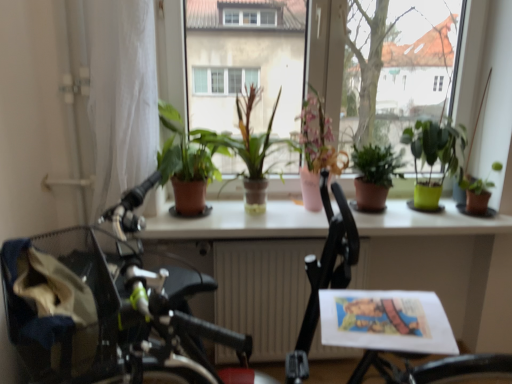
Question: Are green matte plant at center, the fourth houseplant viewed from the left, and green matte plant at center, placed as the 1th houseplant when sorted from left to right, far apart?

Choices:
 (A) no
 (B) yes

Answer: (A)

Question: Is green matte plant at center, placed as the 1th houseplant when sorted from left to right, located within green matte plant at center, the fourth houseplant viewed from the left?

Choices:
 (A) yes
 (B) no

Answer: (B)

Question: Does green matte plant at center, the fourth houseplant viewed from the left, have a larger size compared to green matte plant at center, the sixth houseplant positioned from the right?

Choices:
 (A) yes
 (B) no

Answer: (B)

Question: Considering the relative sizes of green matte plant at center, marked as the 3th houseplant in a right-to-left arrangement, and green matte plant at center, placed as the 1th houseplant when sorted from left to right, in the image provided, is green matte plant at center, marked as the 3th houseplant in a right-to-left arrangement, thinner than green matte plant at center, placed as the 1th houseplant when sorted from left to right,?

Choices:
 (A) yes
 (B) no

Answer: (A)

Question: Is green matte plant at center, the fourth houseplant viewed from the left, behind green matte plant at center, placed as the 1th houseplant when sorted from left to right?

Choices:
 (A) no
 (B) yes

Answer: (B)

Question: Can you confirm if green matte plant at center, the fourth houseplant viewed from the left, is shorter than green matte plant at center, placed as the 1th houseplant when sorted from left to right?

Choices:
 (A) no
 (B) yes

Answer: (B)

Question: Considering the relative sizes of pink ceramic vase at center, which is counted as the 4th houseplant, starting from the right, and green matte plant at center, the fourth houseplant viewed from the left, in the image provided, is pink ceramic vase at center, which is counted as the 4th houseplant, starting from the right, taller than green matte plant at center, the fourth houseplant viewed from the left,?

Choices:
 (A) yes
 (B) no

Answer: (A)

Question: Is green matte plant at center, the fourth houseplant viewed from the left, inside pink ceramic vase at center, which is counted as the 4th houseplant, starting from the right?

Choices:
 (A) yes
 (B) no

Answer: (B)

Question: Does pink ceramic vase at center, which is counted as the third houseplant, starting from the left, have a lesser height compared to green matte plant at center, marked as the 3th houseplant in a right-to-left arrangement?

Choices:
 (A) no
 (B) yes

Answer: (A)

Question: Does pink ceramic vase at center, which is counted as the 4th houseplant, starting from the right, have a larger size compared to green matte plant at center, the fourth houseplant viewed from the left?

Choices:
 (A) no
 (B) yes

Answer: (B)

Question: Can you confirm if pink ceramic vase at center, which is counted as the 4th houseplant, starting from the right, is positioned to the left of green matte plant at center, the fourth houseplant viewed from the left?

Choices:
 (A) yes
 (B) no

Answer: (A)

Question: Is green matte plant at center, marked as the 3th houseplant in a right-to-left arrangement, at the back of pink ceramic vase at center, which is counted as the 4th houseplant, starting from the right?

Choices:
 (A) yes
 (B) no

Answer: (B)

Question: Can you confirm if green matte plant at center, marked as the 3th houseplant in a right-to-left arrangement, is smaller than pink ceramic vase at center, which is counted as the third houseplant, starting from the left?

Choices:
 (A) yes
 (B) no

Answer: (A)